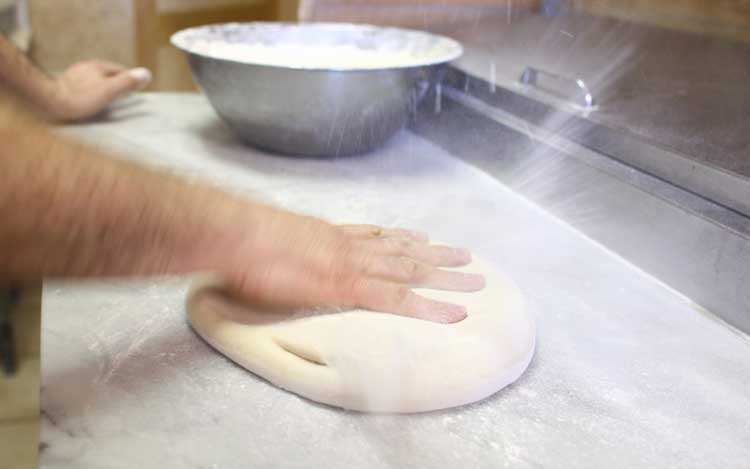
Find the location of a particular element. bowl is located at coordinates (272, 118).